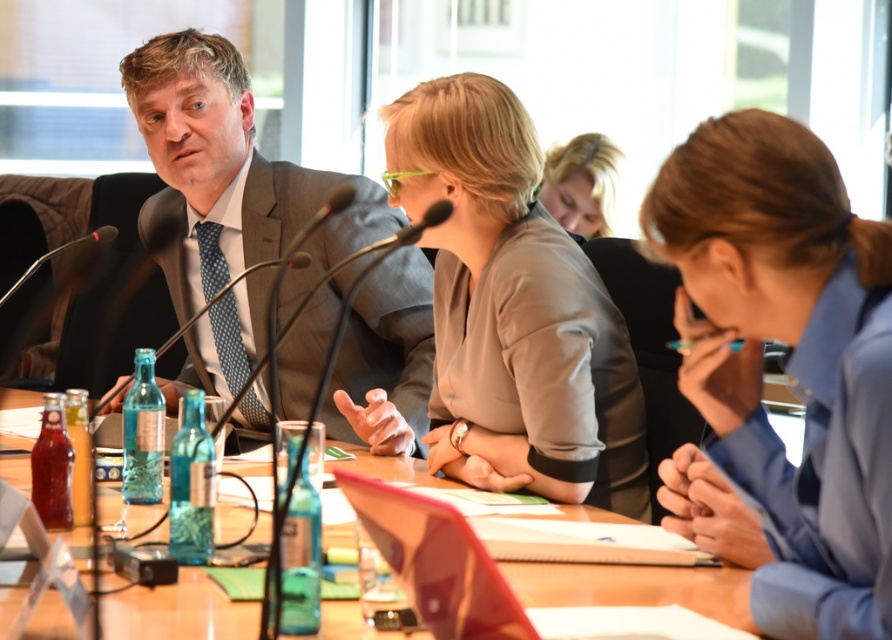
You are organizing a conference and need to ensure that all items on the table are visible to the participants. The conference requires that any documents placed on the table must be clearly visible through the table surface. Which object among the matte gray blouse at center and the translucent glass table at center should you avoid placing documents on top of to maintain visibility?

The translucent glass table at center allows visibility through its surface, so placing documents on it would make them visible. However, the matte gray blouse at center is positioned over the table, meaning documents placed on the blouse would be obscured. To maintain visibility, avoid placing documents on the matte gray blouse at center.

You are a photographer setting up for a group photo. You need to ensure that the matte gray blouse at center and the black matte microphone at left are both visible in the shot. Based on their heights, which object might require you to adjust your camera angle to avoid being obscured?

The matte gray blouse at center is much taller than the black matte microphone at left, so the microphone might be obscured by the blouse if not adjusted. Lowering the camera angle could help ensure both are visible.

You are a photographer positioned at the center of the room. You want to take a photo of the blue fabric shirt at center. Where should you aim your camera to capture it?

You should aim your camera at the point with coordinates 0.561 on the x axis and 0.886 on the y axis to capture the blue fabric shirt at center.